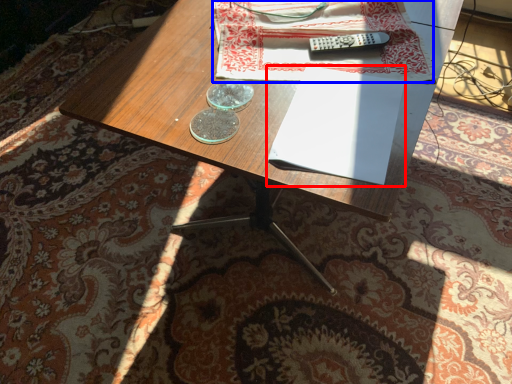
Question: Which object appears closest to the camera in this image, paperback book (highlighted by a red box) or sheet (highlighted by a blue box)?

Choices:
 (A) paperback book
 (B) sheet

Answer: (A)